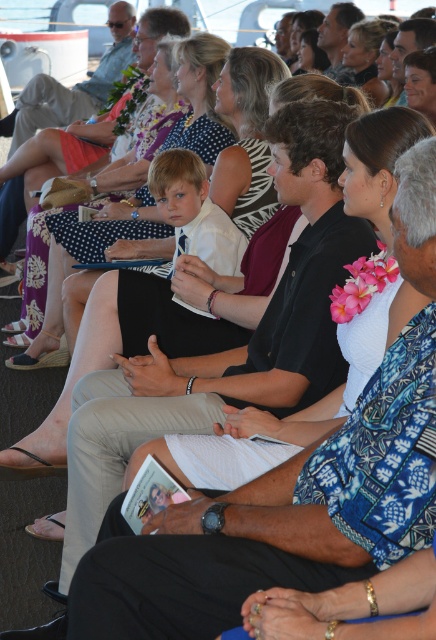
Question: Is black fabric dress at center smaller than matte black shirt at center?

Choices:
 (A) no
 (B) yes

Answer: (B)

Question: Is black fabric dress at center positioned behind white floral dress at center?

Choices:
 (A) yes
 (B) no

Answer: (B)

Question: Which point is closer to the camera taking this photo?

Choices:
 (A) (30, 358)
 (B) (70, 106)
 (C) (177, 536)

Answer: (C)

Question: Among these objects, which one is nearest to the camera?

Choices:
 (A) black fabric dress at center
 (B) white floral dress at center

Answer: (A)

Question: Which of the following is the farthest from the observer?

Choices:
 (A) (112, 77)
 (B) (432, 509)
 (C) (54, 218)

Answer: (A)

Question: Does black fabric dress at center have a smaller size compared to matte black shirt at center?

Choices:
 (A) yes
 (B) no

Answer: (A)